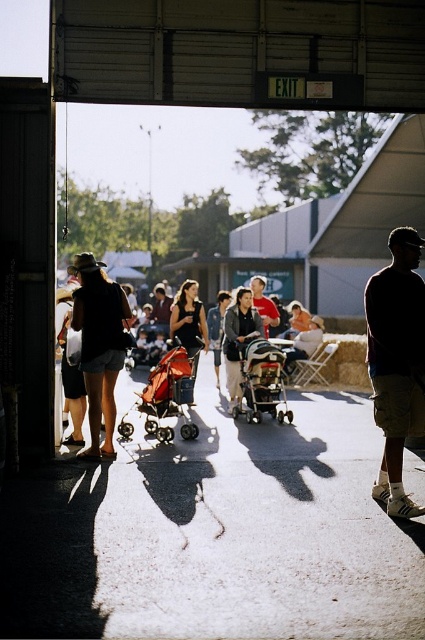
You are standing inside the structure with the open garage door and see the two people in the matte black dress at center and the matte red shirt at center. Which one is closer to the door?

The matte black dress at center is closer to the door because it is in front of the matte red shirt at center.